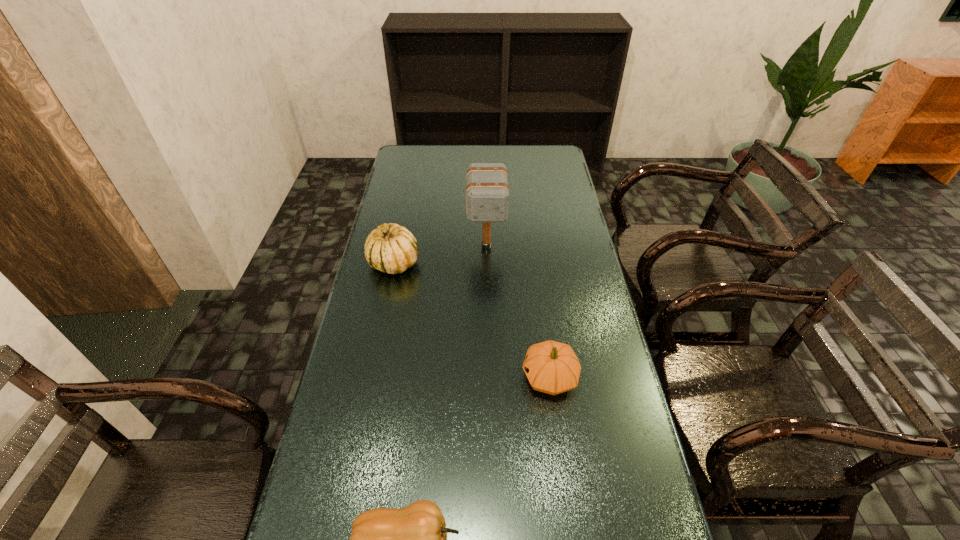
This screenshot has width=960, height=540. I want to click on mallet, so click(x=487, y=193).

Locate an element on the screen. the farthest gourd is located at coordinates (392, 249).

The width and height of the screenshot is (960, 540). In order to click on the rightmost gourd in this screenshot , I will do `click(551, 367)`.

The height and width of the screenshot is (540, 960). What are the coordinates of `the second farthest gourd` in the screenshot? It's located at (551, 367).

Locate an element on the screen. The width and height of the screenshot is (960, 540). free space located on the striking surface of the tallest object is located at coordinates (488, 328).

Find the location of a particular element. The height and width of the screenshot is (540, 960). vacant region located 0.300m on the right of the farthest gourd is located at coordinates (508, 263).

Where is `free space located on the side of the third farthest object with the carved face`? The width and height of the screenshot is (960, 540). free space located on the side of the third farthest object with the carved face is located at coordinates (409, 377).

Where is `blank space located 0.190m on the side of the third farthest object with the carved face`? The image size is (960, 540). blank space located 0.190m on the side of the third farthest object with the carved face is located at coordinates (450, 377).

At what (x,y) coordinates should I click in order to perform the action: click on vacant region located on the side of the third farthest object with the carved face. Please return your answer as a coordinate pair (x, y). The width and height of the screenshot is (960, 540). Looking at the image, I should click on (476, 377).

At what (x,y) coordinates should I click in order to perform the action: click on object positioned at the left edge. Please return your answer as a coordinate pair (x, y). Looking at the image, I should click on (392, 249).